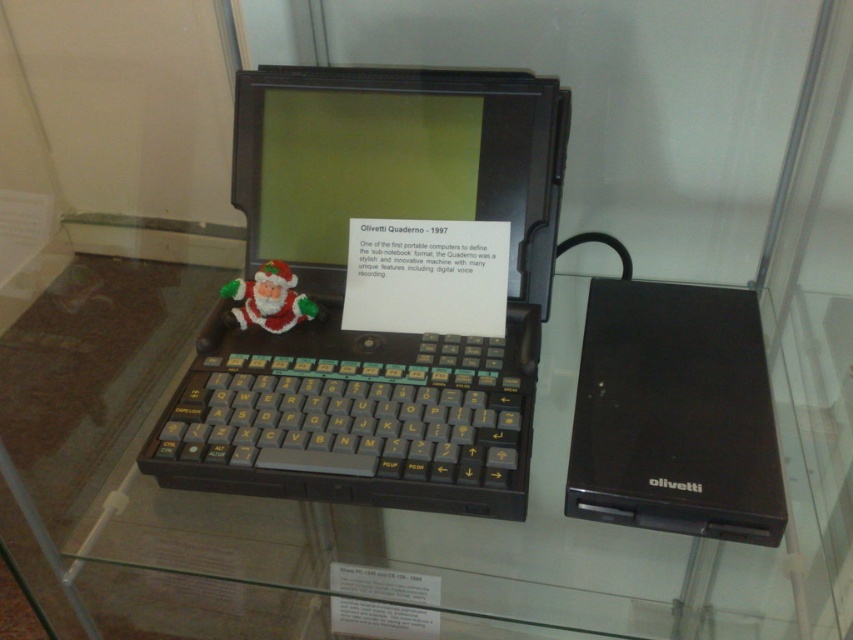
Between point (379, 440) and point (254, 291), which one is positioned behind?

The point (254, 291) is behind.

How much distance is there between black plastic laptop at center and felt santa claus at center?

A distance of 5.59 inches exists between black plastic laptop at center and felt santa claus at center.

The width and height of the screenshot is (853, 640). Describe the element at coordinates (343, 291) in the screenshot. I see `black plastic laptop at center` at that location.

Where is `black plastic laptop at center`? black plastic laptop at center is located at coordinates (343, 291).

Which of these two, transparent glass table at center or black plastic laptop at center, stands shorter?

Standing shorter between the two is black plastic laptop at center.

Can you confirm if transparent glass table at center is smaller than black plastic laptop at center?

Incorrect, transparent glass table at center is not smaller in size than black plastic laptop at center.

Between point (140, 308) and point (311, 243), which one is positioned in front?

Positioned in front is point (311, 243).

Image resolution: width=853 pixels, height=640 pixels. Identify the location of transparent glass table at center. (367, 508).

Which is behind, point (822, 600) or point (608, 480)?

The point (608, 480) is more distant.

Looking at this image, is transparent glass table at center closer to camera compared to black plastic laptop at right?

Yes, transparent glass table at center is closer to the viewer.

Between point (4, 348) and point (622, 451), which one is positioned behind?

The point (4, 348) is behind.

The width and height of the screenshot is (853, 640). In order to click on transparent glass table at center in this screenshot , I will do `click(367, 508)`.